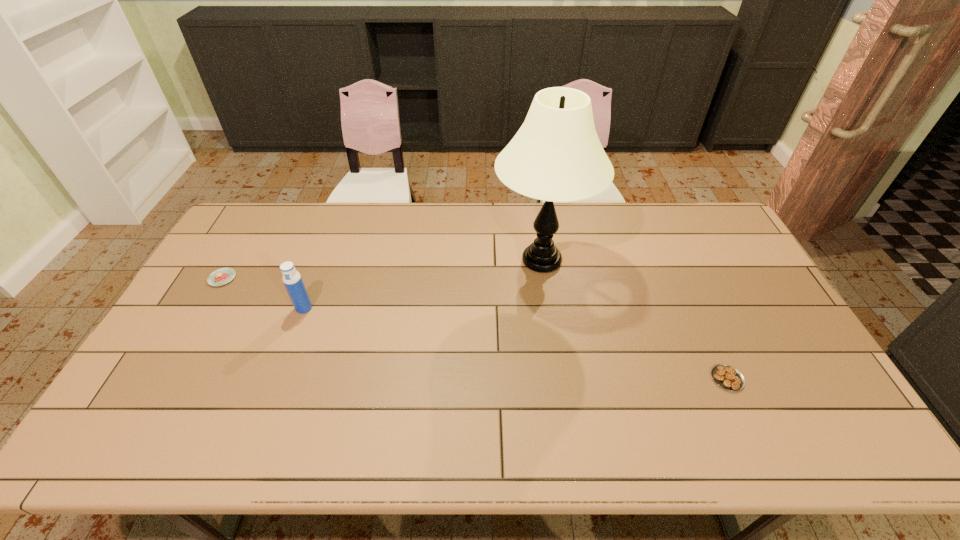
What are the coordinates of `free space located 0.100m on the front of the leftmost object` in the screenshot? It's located at (203, 312).

Find the location of `vacant region located on the right of the rightmost object`. vacant region located on the right of the rightmost object is located at coordinates (808, 379).

Image resolution: width=960 pixels, height=540 pixels. What are the coordinates of `object that is at the far edge` in the screenshot? It's located at (556, 156).

Identify the location of object positioned at the left edge. (222, 276).

The height and width of the screenshot is (540, 960). Find the location of `vacant region at the far edge of the desktop`. vacant region at the far edge of the desktop is located at coordinates (562, 213).

What are the coordinates of `vacant space at the near edge of the desktop` in the screenshot? It's located at (512, 445).

The width and height of the screenshot is (960, 540). I want to click on vacant space at the left edge, so click(248, 251).

The width and height of the screenshot is (960, 540). Find the location of `vacant region at the right edge of the desktop`. vacant region at the right edge of the desktop is located at coordinates (723, 255).

Locate an element on the screen. This screenshot has width=960, height=540. free region at the near left corner is located at coordinates (132, 420).

Identify the location of free point between the right pastry and the second object from right to left. (635, 319).